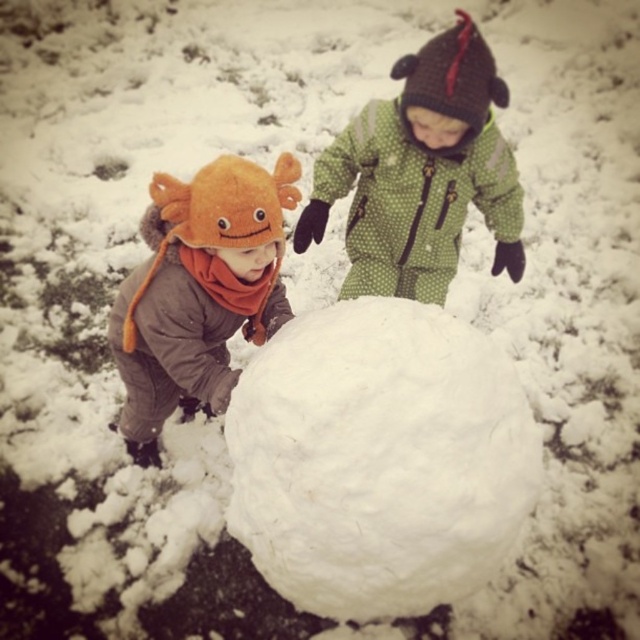
How much distance is there between green dotted snowsuit at center and orange fuzzy hat at left?

The distance of green dotted snowsuit at center from orange fuzzy hat at left is 29.95 inches.

Does green dotted snowsuit at center have a larger size compared to orange fuzzy hat at left?

No, green dotted snowsuit at center is not bigger than orange fuzzy hat at left.

Does point (385, 100) come farther from viewer compared to point (177, 259)?

Yes, it is.

The width and height of the screenshot is (640, 640). Find the location of `green dotted snowsuit at center`. green dotted snowsuit at center is located at coordinates (420, 173).

Between point (332, 348) and point (273, 204), which one is positioned in front?

Point (332, 348) is in front.

Who is more distant from viewer, (486, 467) or (264, 310)?

Point (264, 310)

Is point (474, 579) farther from viewer compared to point (280, 164)?

Yes.

At what (x,y) coordinates should I click in order to perform the action: click on white fluffy snowball at center. Please return your answer as a coordinate pair (x, y). Looking at the image, I should click on (378, 458).

Does white fluffy snowball at center come in front of green dotted snowsuit at center?

Yes.

Does white fluffy snowball at center have a lesser width compared to green dotted snowsuit at center?

Correct, white fluffy snowball at center's width is less than green dotted snowsuit at center's.

The width and height of the screenshot is (640, 640). What are the coordinates of `white fluffy snowball at center` in the screenshot? It's located at (378, 458).